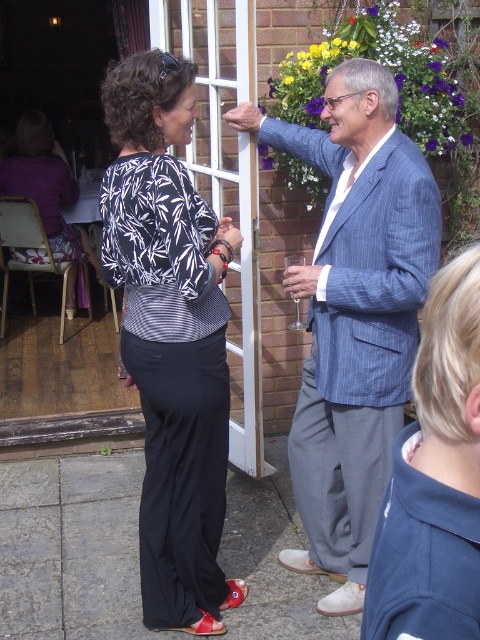
Does blonde hair at right appear over white glass screen door at upper center?

Actually, blonde hair at right is below white glass screen door at upper center.

What do you see at coordinates (434, 480) in the screenshot? This screenshot has width=480, height=640. I see `blonde hair at right` at bounding box center [434, 480].

Where is `blonde hair at right`? blonde hair at right is located at coordinates (434, 480).

Identify the location of blonde hair at right. (434, 480).

Does point (137, 99) come behind point (403, 467)?

Yes, point (137, 99) is farther from viewer.

Which is above, matte black pants at center or blonde hair at right?

Positioned higher is matte black pants at center.

Is point (194, 461) positioned in front of point (466, 525)?

No, it is not.

I want to click on matte black pants at center, so click(170, 337).

Who is higher up, blue striped blazer at upper right or white glass screen door at upper center?

white glass screen door at upper center is above.

Can you confirm if blue striped blazer at upper right is shorter than white glass screen door at upper center?

Indeed, blue striped blazer at upper right has a lesser height compared to white glass screen door at upper center.

Find the location of a particular element. The width and height of the screenshot is (480, 640). blue striped blazer at upper right is located at coordinates (354, 314).

Identify the location of blue striped blazer at upper right. This screenshot has width=480, height=640. pos(354,314).